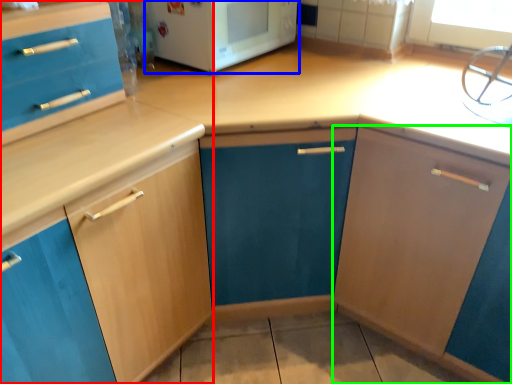
Question: Which object is positioned farthest from cabinetry (highlighted by a red box)? Select from home appliance (highlighted by a blue box) and cabinetry (highlighted by a green box).

Choices:
 (A) home appliance
 (B) cabinetry

Answer: (B)